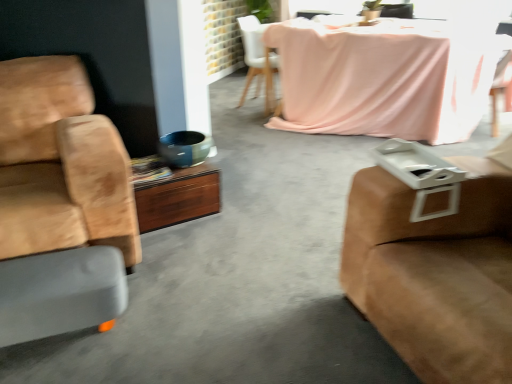
Question: Does gray rubber footrest at lower left lie behind pink fabric chair at upper center, the first chair when ordered from back to front?

Choices:
 (A) no
 (B) yes

Answer: (A)

Question: Does gray rubber footrest at lower left appear on the left side of pink fabric chair at upper center, the first chair when ordered from back to front?

Choices:
 (A) no
 (B) yes

Answer: (B)

Question: From the image's perspective, would you say gray rubber footrest at lower left is shown under pink fabric chair at upper center, the third chair in the front-to-back sequence?

Choices:
 (A) yes
 (B) no

Answer: (A)

Question: Considering the relative sizes of gray rubber footrest at lower left and pink fabric chair at upper center, the third chair in the front-to-back sequence, in the image provided, is gray rubber footrest at lower left thinner than pink fabric chair at upper center, the third chair in the front-to-back sequence,?

Choices:
 (A) no
 (B) yes

Answer: (B)

Question: From the image's perspective, is gray rubber footrest at lower left over pink fabric chair at upper center, the third chair in the front-to-back sequence?

Choices:
 (A) yes
 (B) no

Answer: (B)

Question: Does point (41, 205) appear closer or farther from the camera than point (390, 283)?

Choices:
 (A) closer
 (B) farther

Answer: (B)

Question: From the image's perspective, is suede tan chair at left, placed as the third chair when sorted from right to left, located above or below suede brown studio couch at right?

Choices:
 (A) below
 (B) above

Answer: (B)

Question: From a real-world perspective, relative to suede brown studio couch at right, is suede tan chair at left, placed as the third chair when sorted from right to left, vertically above or below?

Choices:
 (A) below
 (B) above

Answer: (B)

Question: In terms of height, does suede tan chair at left, the first chair viewed from the front, look taller or shorter compared to suede brown studio couch at right?

Choices:
 (A) short
 (B) tall

Answer: (B)

Question: From a real-world perspective, relative to pink fabric-covered table at upper center, is suede brown studio couch at right vertically above or below?

Choices:
 (A) above
 (B) below

Answer: (A)

Question: Is suede brown studio couch at right spatially inside pink fabric-covered table at upper center, or outside of it?

Choices:
 (A) outside
 (B) inside

Answer: (A)

Question: Considering their positions, is suede brown studio couch at right located in front of or behind pink fabric-covered table at upper center?

Choices:
 (A) behind
 (B) front

Answer: (B)

Question: Considering the relative positions of suede brown studio couch at right and pink fabric-covered table at upper center in the image provided, is suede brown studio couch at right to the left or to the right of pink fabric-covered table at upper center?

Choices:
 (A) left
 (B) right

Answer: (A)

Question: Would you say wooden desk at center is inside or outside suede brown studio couch at right?

Choices:
 (A) outside
 (B) inside

Answer: (A)

Question: In terms of width, does wooden desk at center look wider or thinner when compared to suede brown studio couch at right?

Choices:
 (A) wide
 (B) thin

Answer: (B)